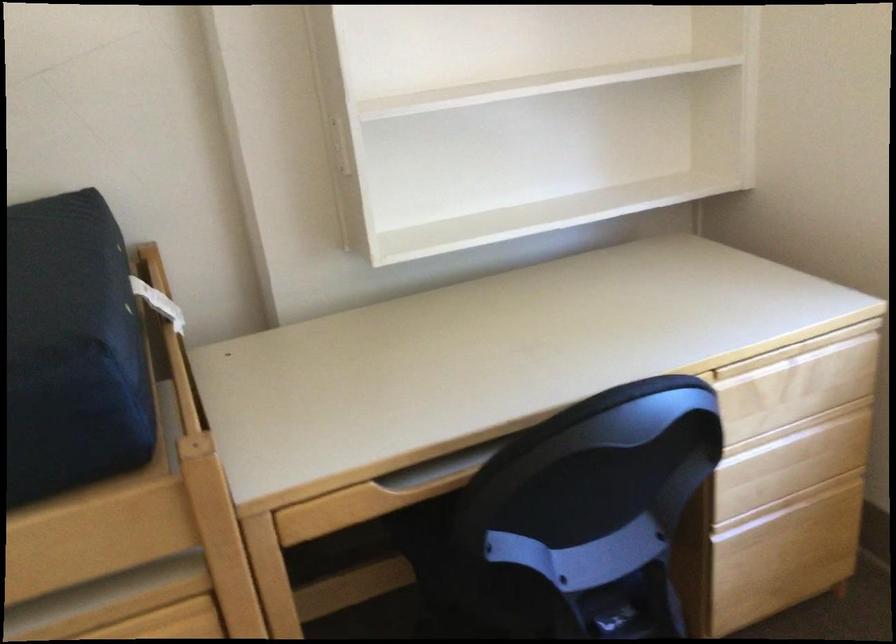
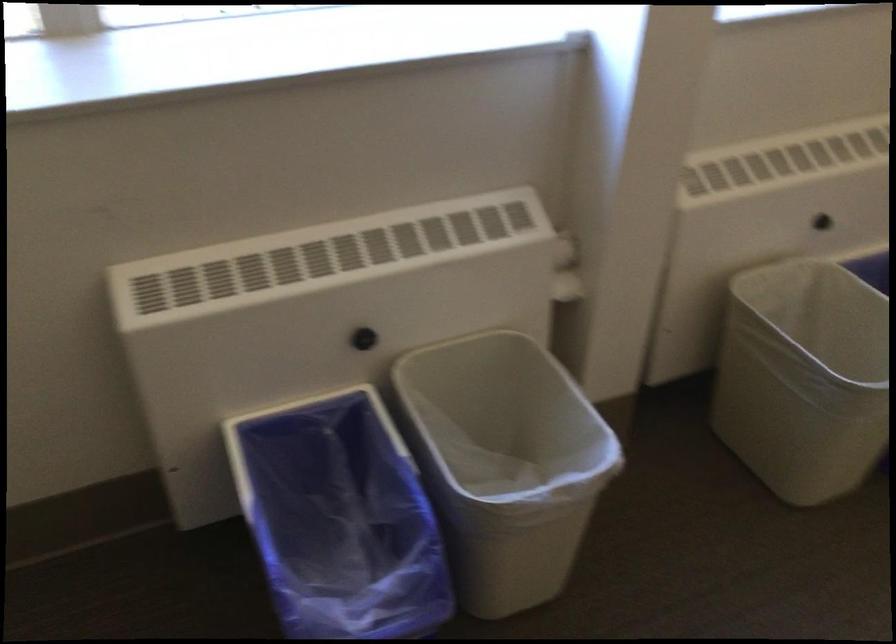
The images are taken continuously from a first-person perspective. In which direction is your viewpoint rotating?

The camera rotated toward right-down.